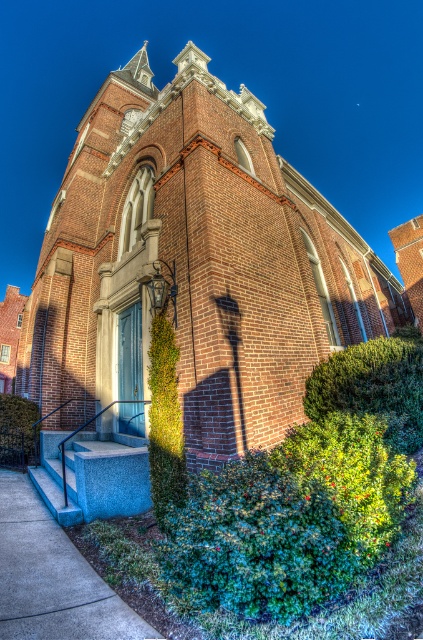
Is concrete at lower left wider than green leafy hedge at center?

Indeed, concrete at lower left has a greater width compared to green leafy hedge at center.

Does concrete at lower left lie behind green leafy hedge at center?

No, concrete at lower left is closer to the viewer.

Does point (8, 620) come in front of point (158, 362)?

Yes, point (8, 620) is closer to viewer.

This screenshot has width=423, height=640. Identify the location of concrete at lower left. pyautogui.click(x=52, y=577).

Between brick church at center and green leafy hedge at lower left, which one has less height?

With less height is green leafy hedge at lower left.

Does brick church at center lie behind green leafy hedge at lower left?

No, it is not.

Which is behind, point (136, 330) or point (16, 406)?

The point (16, 406) is behind.

Where is `brick church at center`? The image size is (423, 640). brick church at center is located at coordinates (192, 269).

Which of these two, brick church at center or concrete at lower left, stands taller?

Standing taller between the two is brick church at center.

Can you confirm if brick church at center is positioned to the left of concrete at lower left?

Incorrect, brick church at center is not on the left side of concrete at lower left.

The width and height of the screenshot is (423, 640). Describe the element at coordinates (192, 269) in the screenshot. I see `brick church at center` at that location.

Find the location of a particular element. The width and height of the screenshot is (423, 640). brick church at center is located at coordinates (192, 269).